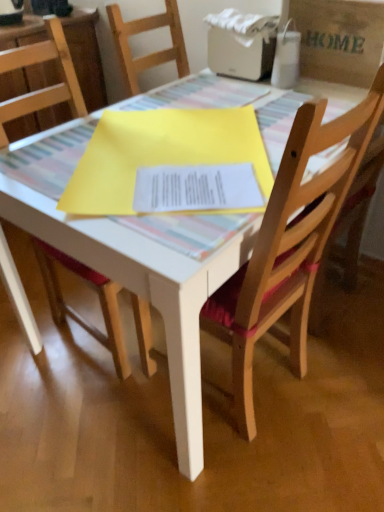
This screenshot has height=512, width=384. I want to click on free space in front of wooden chair at center, which is the second chair in right-to-left order, so click(x=59, y=425).